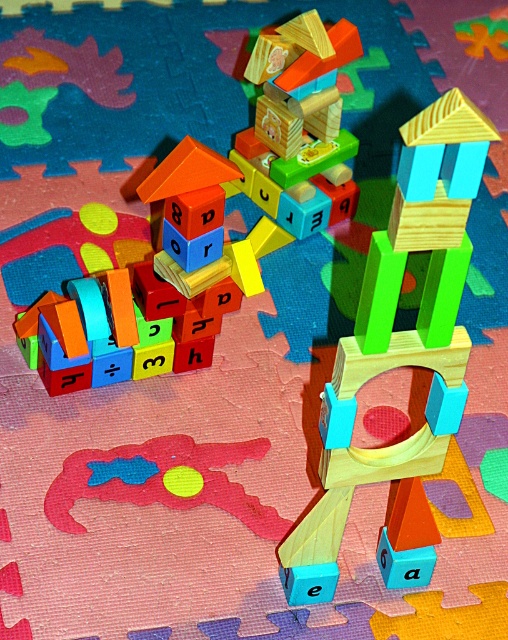
You are a child playing with the wooden toy at center and the rubber duck at center. If you want to stack the rubber duck on top of the wooden toy, will it fit?

The wooden toy at center is much taller than the rubber duck at center, so the rubber duck can be stacked on top of it since it is shorter.

You are a child trying to build a tower taller than the wooden tower at center using the wooden blocks at center. Based on the scene description, can you do this?

The wooden tower at center has a larger size compared to wooden blocks at center, so the wooden blocks at center are smaller. Therefore, you can build a tower taller than the wooden tower at center by stacking multiple wooden blocks at center on top of each other.

Based on the photo, you are standing in front of a colorful play area with wooden blocks arranged on a vibrant mat. You notice a specific point marked at coordinates point (x=264, y=44). If you want to place a toy car that requires 3.5 feet of space to move forward, will there be enough space between you and that point for the car to move?

The distance between you and the point (x=264, y=44) is 4.08 feet, which is greater than the 3.5 feet required. Therefore, there is enough space for the toy car to move.